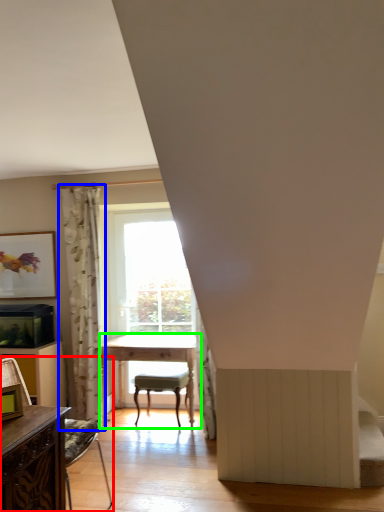
Question: Which object is positioned closest to chair (highlighted by a red box)? Select from curtain (highlighted by a blue box) and table (highlighted by a green box).

Choices:
 (A) curtain
 (B) table

Answer: (B)